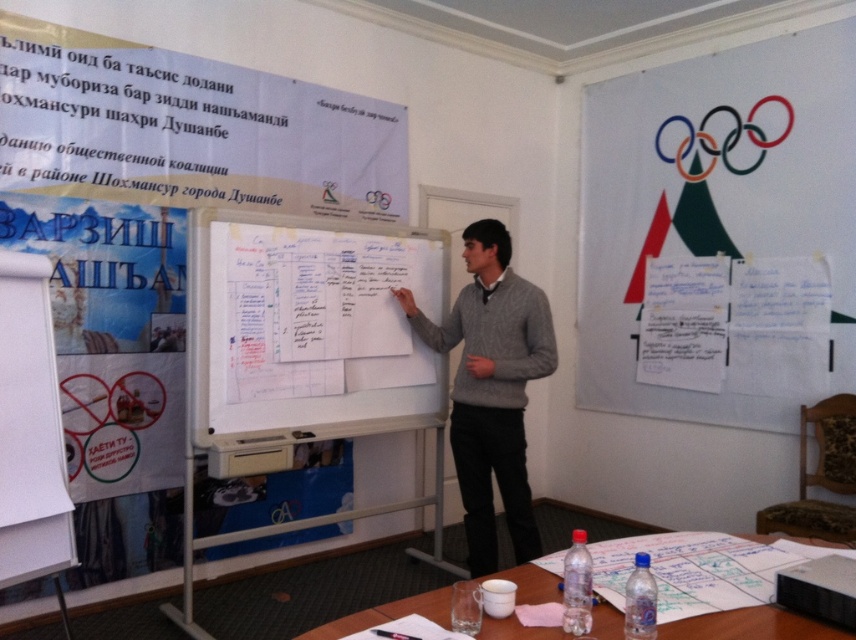
Who is positioned more to the right, white paper at upper right or gray sweater at center?

white paper at upper right

Can you confirm if white paper at upper right is shorter than gray sweater at center?

No, white paper at upper right is not shorter than gray sweater at center.

Locate an element on the screen. This screenshot has width=856, height=640. white paper at upper right is located at coordinates (714, 202).

Which is more to the right, white paperboard at upper left or white paper at upper right?

white paper at upper right

From the picture: How much distance is there between white paperboard at upper left and white paper at upper right?

white paperboard at upper left and white paper at upper right are 2.18 meters apart from each other.

Does point (28, 58) come in front of point (586, 264)?

Yes.

Image resolution: width=856 pixels, height=640 pixels. I want to click on white paperboard at upper left, so click(158, 230).

In the scene shown: Does white paper at upper right appear under white paper at lower center?

No.

Is white paper at upper right above white paper at lower center?

Yes, white paper at upper right is above white paper at lower center.

The width and height of the screenshot is (856, 640). Find the location of `white paper at upper right`. white paper at upper right is located at coordinates (714, 202).